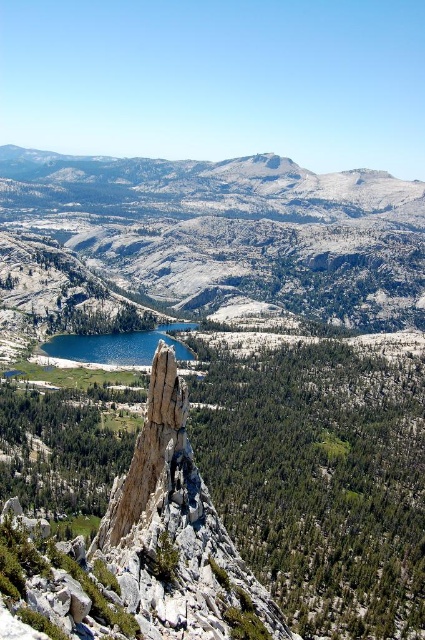
Based on the scene description, where is the smooth gray rock formation at center located in terms of its 2D coordinates?

The smooth gray rock formation at center is located at the 2D coordinates of point (175, 531).

You are a hiker planning to take a photo of the smooth gray rock formation at center and the blue glassy lake at center. Since you want both in focus, which one should you focus on to ensure the other is also sharp? Explain using their positions.

You should focus on the smooth gray rock formation at center because it is closer to the viewer than the blue glassy lake at center. By focusing on the closer object, the depth of field will extend further back, increasing the likelihood that both are in focus.

You are a hiker planning to take a photo of both the snowy granite mountain at center and the blue glassy lake at center. Since you want both to be clearly visible in the frame, which object should you position closer to the camera to ensure they are both in focus?

To ensure both the snowy granite mountain at center and the blue glassy lake at center are in focus, you should position the snowy granite mountain at center closer to the camera since it is larger in size compared to the blue glassy lake at center. This way, the depth of field will cover both objects effectively.